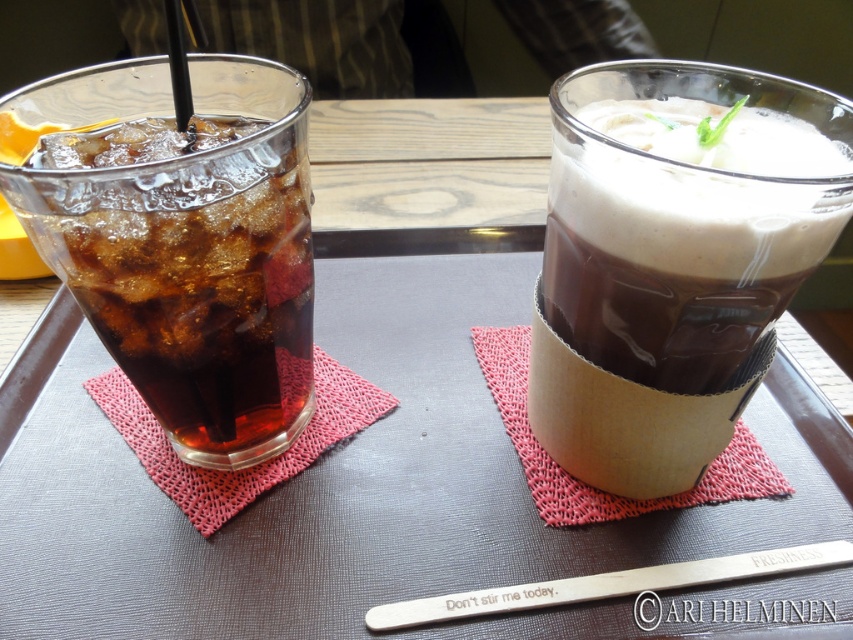
In the scene shown: You are at a cafe and want to grab your drink without spilling. Which beverage should you pick up first, the smooth chocolate milkshake at center or the translucent glass at left, if the one closer to you is easier to reach?

The smooth chocolate milkshake at center is in front of the translucent glass at left, so it is closer and easier to reach. You should pick up the smooth chocolate milkshake at center first to avoid spilling.

You are holding a smartphone camera 8 inches away from the smooth chocolate milkshake at center. Can you capture the milkshake in focus without moving your phone?

The smooth chocolate milkshake at center is 7.52 inches away from the camera. Since your phone is 8 inches away, it is slightly farther than the required distance, so you might need to move closer for better focus.

You are at a cafe and want to order a drink. The server points to the location at point (x=666, y=276) on the menu board. What drink is available at that location?

The point (x=666, y=276) corresponds to the smooth chocolate milkshake at center.